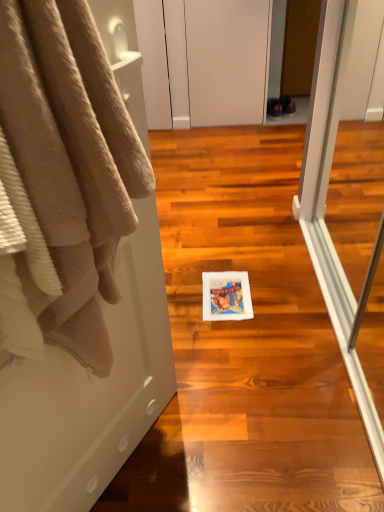
I want to click on vacant space situated above white paper towel at center (from a real-world perspective), so click(263, 218).